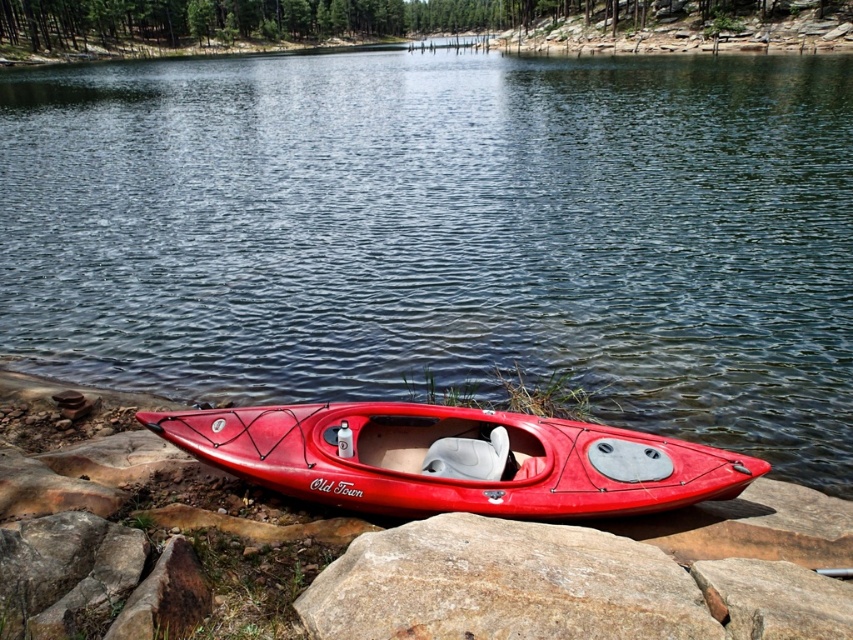
Can you confirm if shiny red kayak at lower center is positioned to the left of smooth plastic seat at center?

Indeed, shiny red kayak at lower center is positioned on the left side of smooth plastic seat at center.

Is shiny red kayak at lower center taller than smooth plastic seat at center?

Yes.

Is point (416, 432) farther from viewer compared to point (432, 458)?

Yes.

The width and height of the screenshot is (853, 640). I want to click on shiny red kayak at lower center, so click(x=454, y=460).

Between clear water at center and smooth plastic seat at center, which one is positioned higher?

Positioned higher is clear water at center.

Can you confirm if clear water at center is positioned below smooth plastic seat at center?

Actually, clear water at center is above smooth plastic seat at center.

Measure the distance between point [654,192] and camera.

Point [654,192] and camera are 77.49 feet apart from each other.

At what (x,y) coordinates should I click in order to perform the action: click on clear water at center. Please return your answer as a coordinate pair (x, y). The image size is (853, 640). Looking at the image, I should click on (445, 234).

Can you confirm if clear water at center is thinner than smooth gray rock at lower center?

In fact, clear water at center might be wider than smooth gray rock at lower center.

Is clear water at center above smooth gray rock at lower center?

Yes, clear water at center is above smooth gray rock at lower center.

Locate an element on the screen. clear water at center is located at coordinates (445, 234).

Locate an element on the screen. clear water at center is located at coordinates (445, 234).